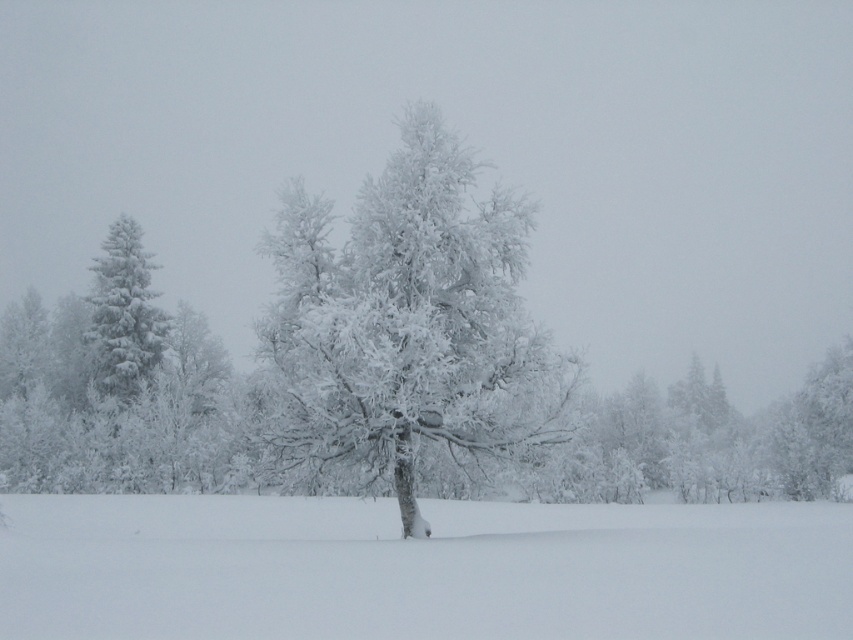
Question: Considering the relative positions of white fluffy snow at center and white frosty tree at left in the image provided, where is white fluffy snow at center located with respect to white frosty tree at left?

Choices:
 (A) above
 (B) below

Answer: (B)

Question: Which of the following is the closest to the observer?

Choices:
 (A) white frosty tree at left
 (B) white frosty tree at center
 (C) white fluffy snow at center

Answer: (C)

Question: Where is white fluffy snow at center located in relation to white frosty tree at center in the image?

Choices:
 (A) below
 (B) above

Answer: (A)

Question: Estimate the real-world distances between objects in this image. Which object is closer to the white frosty tree at left?

Choices:
 (A) white fluffy snow at center
 (B) white frosty tree at center

Answer: (A)

Question: Is white frosty tree at center positioned in front of white frosty tree at left?

Choices:
 (A) no
 (B) yes

Answer: (B)

Question: Estimate the real-world distances between objects in this image. Which object is closer to the white frosty tree at center?

Choices:
 (A) white fluffy snow at center
 (B) white frosty tree at left

Answer: (A)